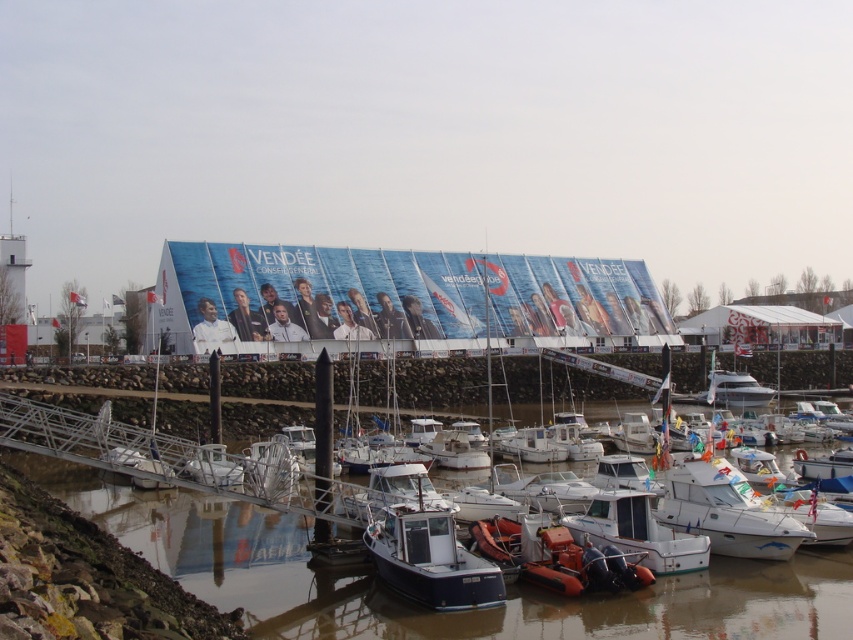
Question: Estimate the real-world distances between objects in this image. Which object is closer to the smooth water at lower center?

Choices:
 (A) white matte boat at center
 (B) blue matte boat at center
 (C) white plastic boat at center

Answer: (B)

Question: Among these objects, which one is farthest from the camera?

Choices:
 (A) white matte boat at center
 (B) blue fabric banner at center

Answer: (B)

Question: Is smooth water at lower center smaller than blue fabric banner at center?

Choices:
 (A) no
 (B) yes

Answer: (B)

Question: Among these points, which one is nearest to the camera?

Choices:
 (A) (505, 627)
 (B) (695, 547)
 (C) (367, 545)

Answer: (A)

Question: Does blue matte boat at center have a smaller size compared to white matte boat at center?

Choices:
 (A) no
 (B) yes

Answer: (A)

Question: Considering the relative positions of blue fabric banner at center and white plastic boat at center in the image provided, where is blue fabric banner at center located with respect to white plastic boat at center?

Choices:
 (A) above
 (B) below

Answer: (A)